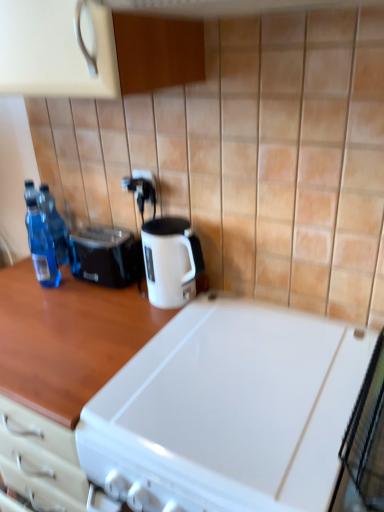
Where is `vacant point to the left of transparent plastic bottles at left, positioned as the second bottle in back-to-front order`? The width and height of the screenshot is (384, 512). vacant point to the left of transparent plastic bottles at left, positioned as the second bottle in back-to-front order is located at coordinates (18, 281).